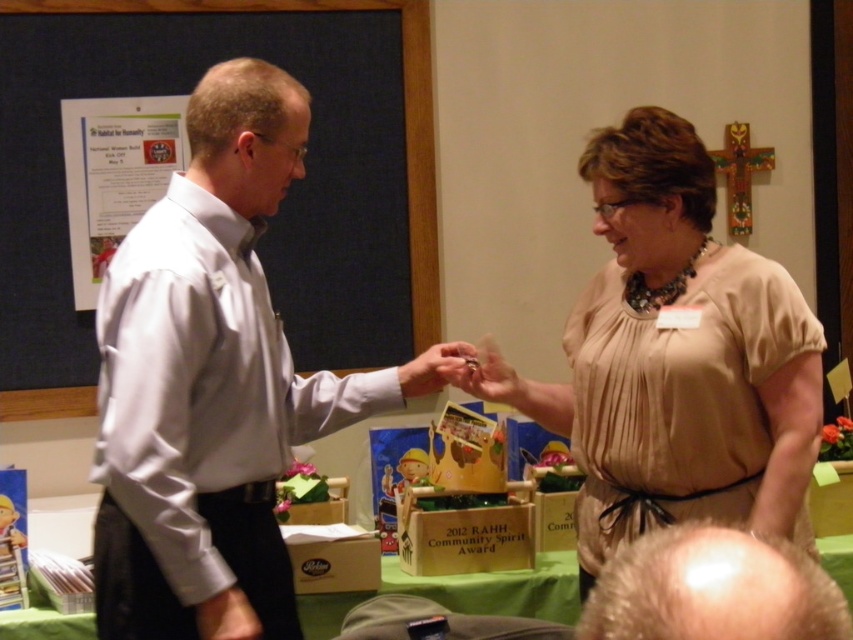
Question: Estimate the real-world distances between objects in this image. Which object is closer to the beige satin blouse at center?

Choices:
 (A) matte silver ring at center
 (B) blue fabric bulletin board at upper left

Answer: (A)

Question: Among these objects, which one is nearest to the camera?

Choices:
 (A) beige satin blouse at center
 (B) metallic ring at center

Answer: (A)

Question: Is blonde hair at lower right bigger than matte silver ring at center?

Choices:
 (A) no
 (B) yes

Answer: (B)

Question: Which of the following is the closest to the observer?

Choices:
 (A) (660, 276)
 (B) (630, 634)

Answer: (B)

Question: Does white shirt at center have a lesser width compared to blue fabric bulletin board at upper left?

Choices:
 (A) no
 (B) yes

Answer: (B)

Question: Does beige satin blouse at center lie in front of metallic ring at center?

Choices:
 (A) no
 (B) yes

Answer: (B)